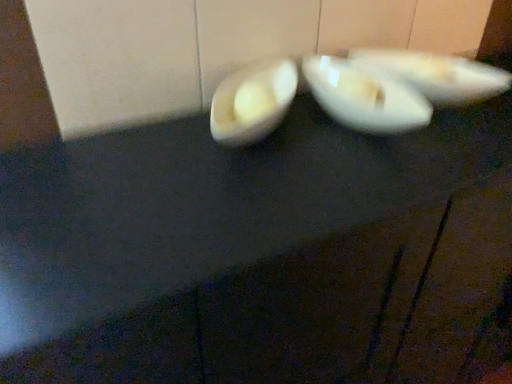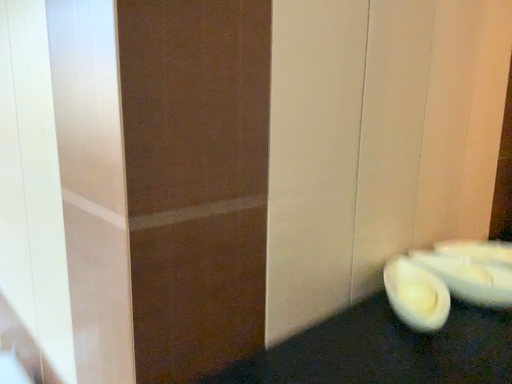
Question: How did the camera likely rotate when shooting the video?

Choices:
 (A) rotated downward
 (B) rotated upward

Answer: (B)